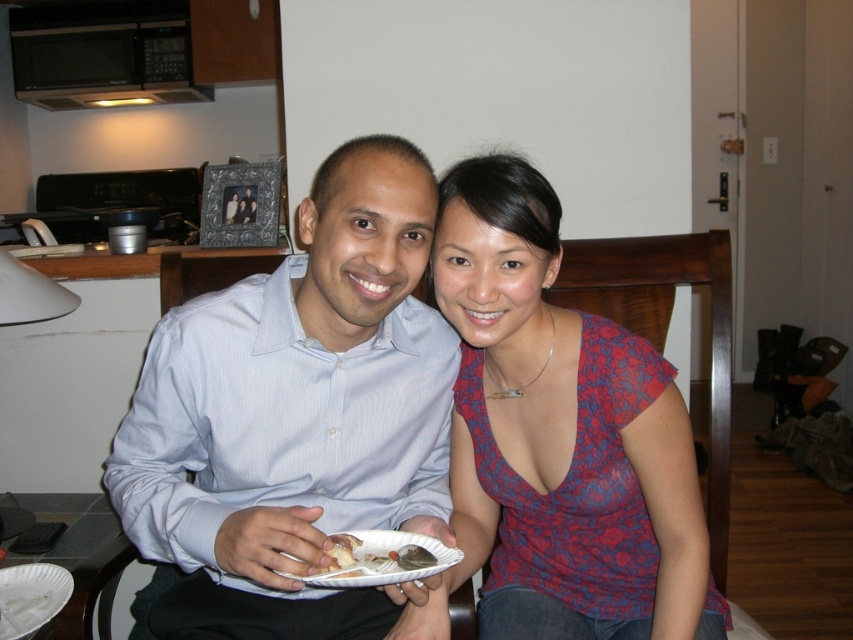
Question: Which point appears farthest from the camera in this image?

Choices:
 (A) (384, 560)
 (B) (289, 570)
 (C) (53, 589)
 (D) (335, 545)

Answer: (C)

Question: Which of these objects is positioned closest to the white paper plate at center?

Choices:
 (A) white paper plate at lower left
 (B) light blue striped shirt at center

Answer: (B)

Question: Does light blue striped shirt at center appear under white matte bread at center?

Choices:
 (A) yes
 (B) no

Answer: (B)

Question: Which is nearer to the floral fabric blouse at center?

Choices:
 (A) white paper plate at center
 (B) light blue striped shirt at center
 (C) white matte bread at center
 (D) white paper plate at lower left

Answer: (B)

Question: Does white paper plate at center appear on the right side of white paper plate at lower left?

Choices:
 (A) no
 (B) yes

Answer: (B)

Question: Where is floral fabric blouse at center located in relation to black matte microwave at upper left in the image?

Choices:
 (A) left
 (B) right

Answer: (B)